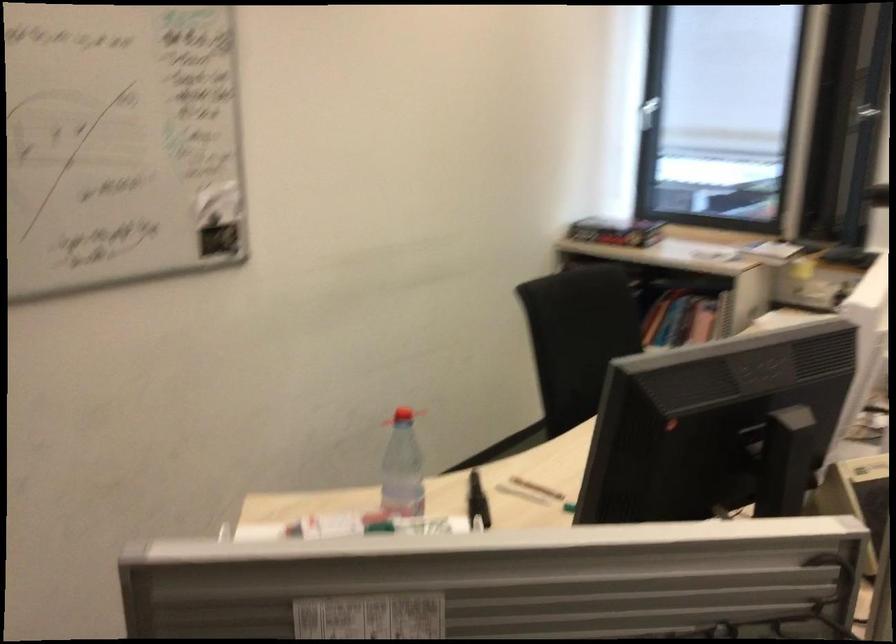
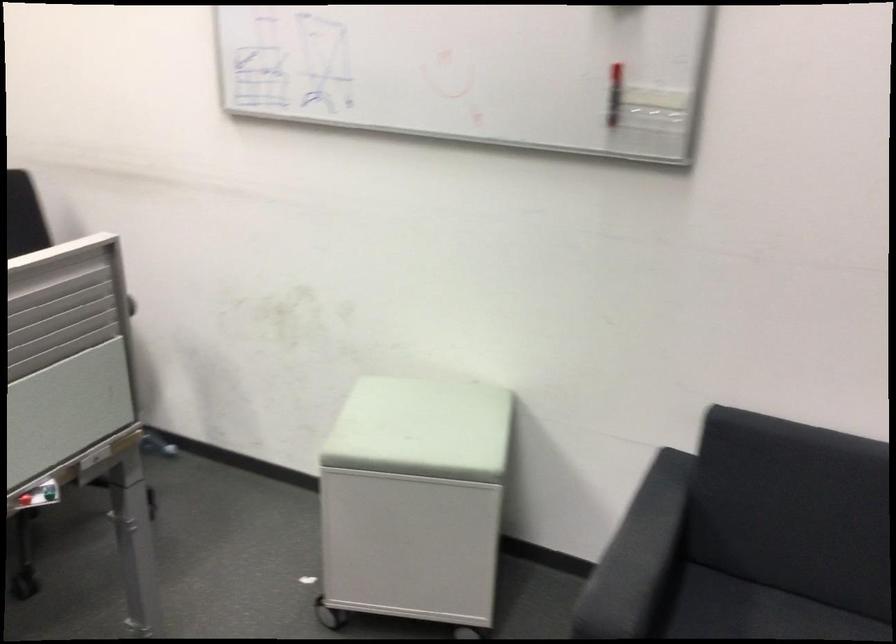
The first image is from the beginning of the video and the second image is from the end. How did the camera likely rotate when shooting the video?

The camera rotated toward right-down.